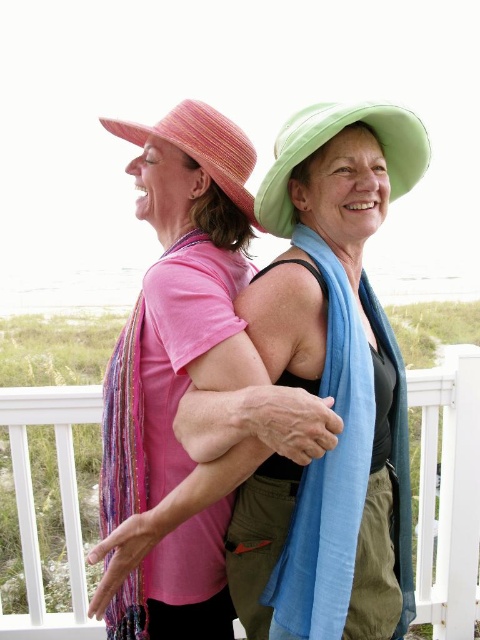
Can you confirm if blue silk scarf at center is taller than green fabric hat at upper center?

Indeed, blue silk scarf at center has a greater height compared to green fabric hat at upper center.

Between blue silk scarf at center and green fabric hat at upper center, which one appears on the right side from the viewer's perspective?

blue silk scarf at center

This screenshot has height=640, width=480. What do you see at coordinates (328, 474) in the screenshot?
I see `blue silk scarf at center` at bounding box center [328, 474].

This screenshot has width=480, height=640. Find the location of `blue silk scarf at center`. blue silk scarf at center is located at coordinates (328, 474).

Between pink woven scarf at left and green fabric hat at upper center, which one has less height?

Standing shorter between the two is green fabric hat at upper center.

Does point (106, 387) lie in front of point (288, 161)?

That is False.

Find the location of a particular element. pink woven scarf at left is located at coordinates (178, 300).

Who is lower down, matte green hat at center or blue silk scarf at center?

blue silk scarf at center

Locate an element on the screen. matte green hat at center is located at coordinates pyautogui.click(x=331, y=387).

Who is more distant from viewer, (x=283, y=314) or (x=303, y=624)?

Point (x=283, y=314)

Locate an element on the screen. This screenshot has height=640, width=480. matte green hat at center is located at coordinates (331, 387).